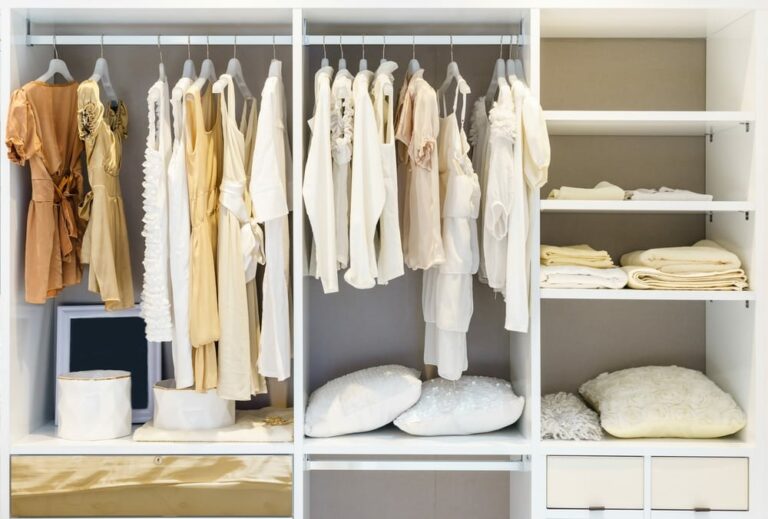
This screenshot has width=768, height=519. What are the coordinates of `cupboard space` in the screenshot? It's located at (621, 64), (621, 176), (613, 242), (613, 365), (391, 339), (194, 339).